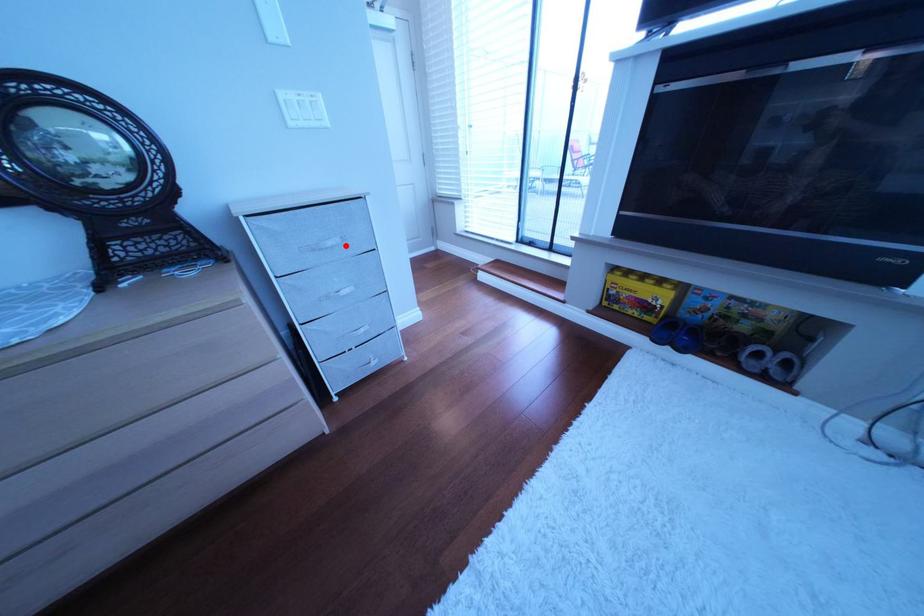
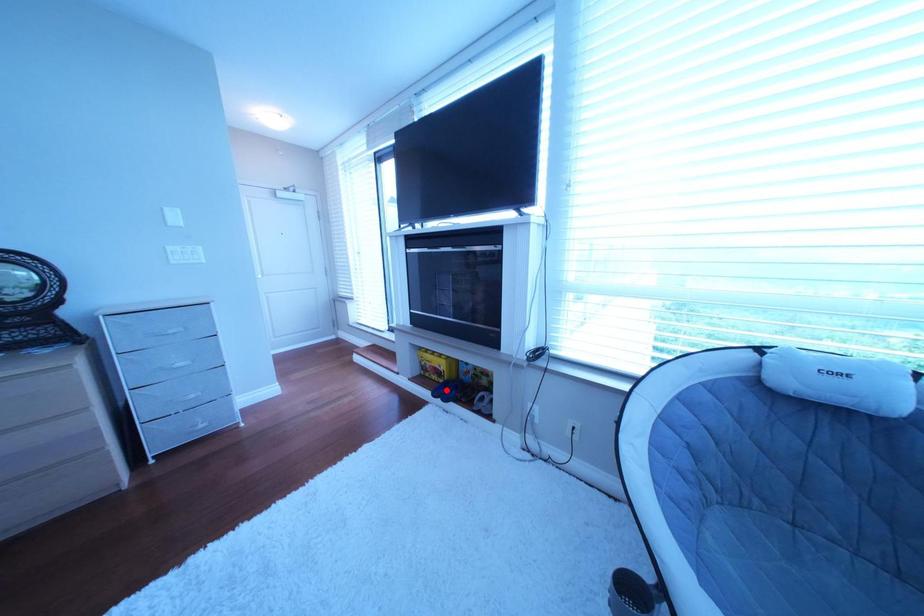
I am providing you with two images of the same scene from different viewpoints. A red point is marked on the first image and another point is marked on the second image. Is the marked point in image1 the same physical position as the marked point in image2?

No